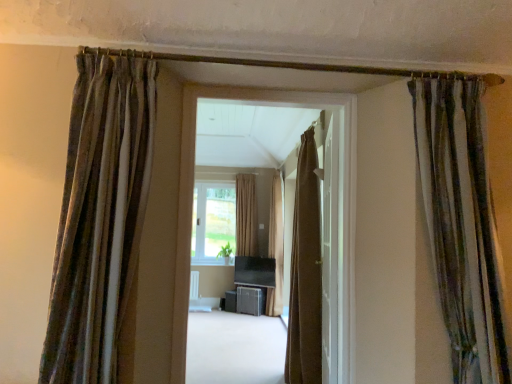
Question: Is smooth beige carpet at center in front of or behind brown textured curtain at center, the third curtain viewed from the right, in the image?

Choices:
 (A) front
 (B) behind

Answer: (A)

Question: From a real-world perspective, is smooth beige carpet at center above or below brown textured curtain at center, the fourth curtain in the front-to-back sequence?

Choices:
 (A) below
 (B) above

Answer: (A)

Question: Considering the real-world distances, which object is farthest from the brown fabric curtain at center?

Choices:
 (A) metallic gray cabinet at center, which is counted as the second furniture, starting from the bottom
 (B) beige fabric curtain at center, the 1th curtain when ordered from back to front
 (C) matte black tv at center, the 3th furniture ordered from the bottom
 (D) smooth beige carpet at center
 (E) velvet striped curtain at upper left, placed as the 1th curtain when sorted from left to right

Answer: (B)

Question: Estimate the real-world distances between objects in this image. Which object is closer to the brown fabric curtain at center?

Choices:
 (A) metallic gray cabinet at center, which is counted as the second furniture, starting from the bottom
 (B) matte black tv at center, the 3th furniture ordered from the bottom
 (C) matte black speaker at center, placed as the first furniture when sorted from bottom to top
 (D) beige fabric curtain at center, the fifth curtain from the front
 (E) brown textured curtain at center, acting as the third curtain starting from the front

Answer: (E)